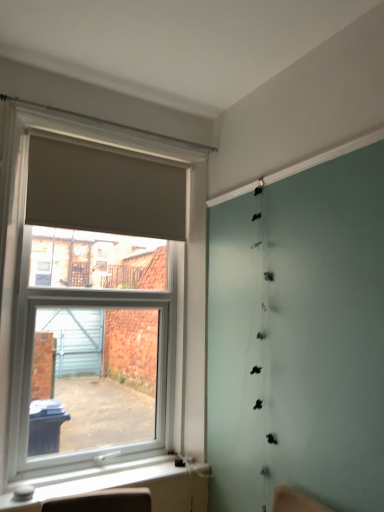
Where is `vacant location below matte gray roller blind at left (from a real-world perspective)`? This screenshot has height=512, width=384. vacant location below matte gray roller blind at left (from a real-world perspective) is located at coordinates (116, 474).